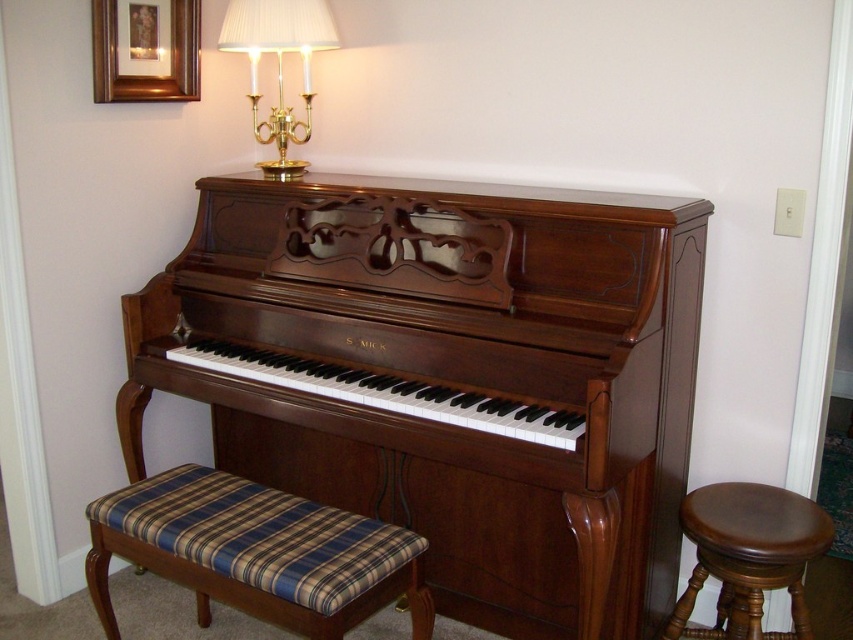
You are a musician who wants to sit closer to the piano keys. Which seat should you choose between the plaid fabric bench at lower left and the brown leather stool at right?

The plaid fabric bench at lower left is to the left of the brown leather stool at right, so choosing the plaid fabric bench at lower left would place you closer to the piano keys.

You are a guest at a housewarming party and want to sit near the piano. You see the plaid fabric bench at lower left and the brown leather stool at right. Which one is shorter in height?

The plaid fabric bench at lower left is not as tall as the brown leather stool at right, so the plaid fabric bench at lower left is shorter in height.

You are standing in the room where the classic upright piano is located. You see two points marked in the scene. The first point is at coordinates point (378, 458) and the second point is at point (306, 22). Which of these points is closer to the back wall of the room?

Point (378, 458) is behind point (306, 22), so it is closer to the back wall of the room.